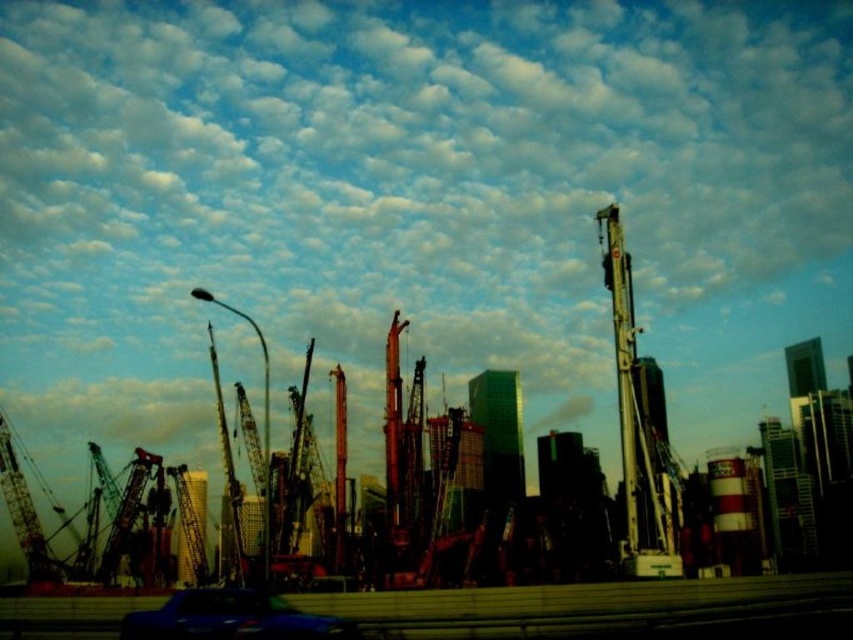
You are a delivery driver who needs to navigate your truck through the construction site. You see the metallic gray crane at right and the metallic blue car at lower center. Which object is located to the right of the other?

The metallic gray crane at right is positioned on the right side of the metallic blue car at lower center, so the metallic gray crane at right is to the right of the metallic blue car at lower center.

You are a delivery driver who needs to pass through the construction site. You see the metallic gray crane at right and the metallic blue car at lower center. Which object is blocking your path?

The metallic gray crane at right is blocking your path because the metallic blue car at lower center is behind it, meaning the crane is in front of the car and thus in your way.